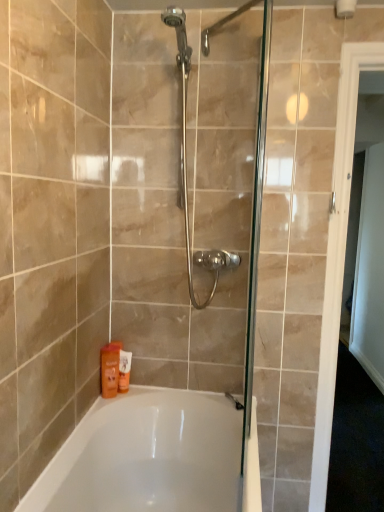
Locate an element on the screen. This screenshot has width=384, height=512. vacant space to the right of orange matte bottle at lower left, which ranks as the second toiletry in back-to-front order is located at coordinates (160, 390).